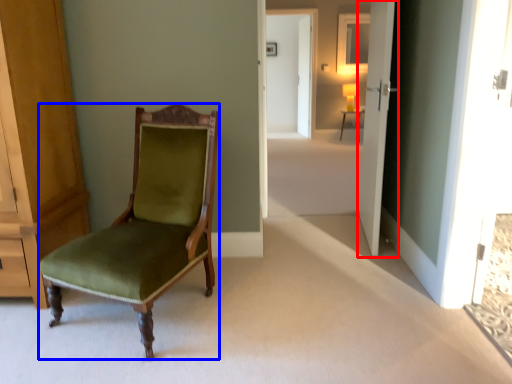
Question: Which of the following is the farthest to the observer, door (highlighted by a red box) or chair (highlighted by a blue box)?

Choices:
 (A) door
 (B) chair

Answer: (A)